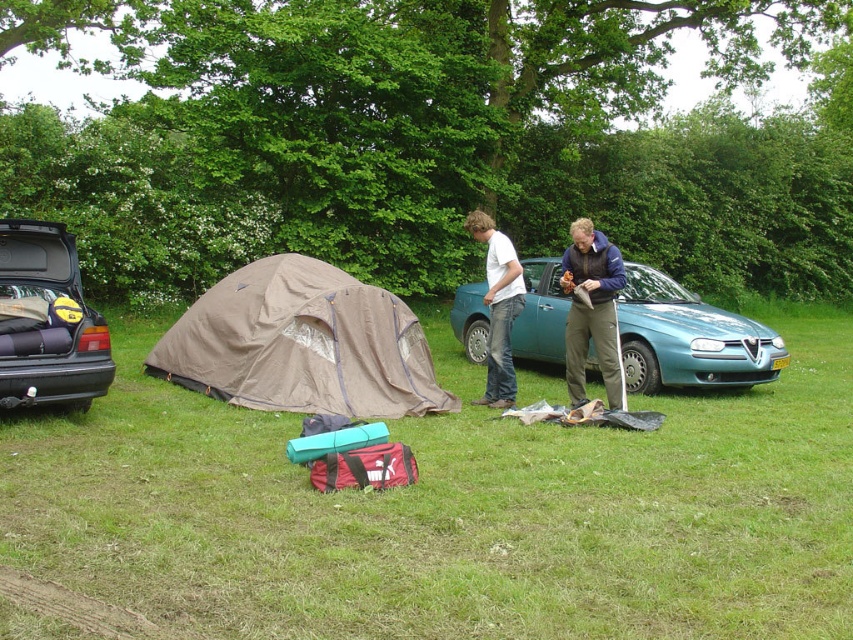
You are standing at point (302, 344) in the camping scene. What object is located exactly at your current position?

The brown fabric tent at center is located exactly at point (302, 344).